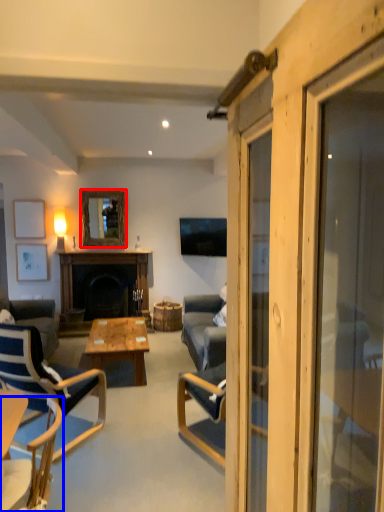
Question: Which object appears closest to the camera in this image, mirror (highlighted by a red box) or chair (highlighted by a blue box)?

Choices:
 (A) mirror
 (B) chair

Answer: (B)